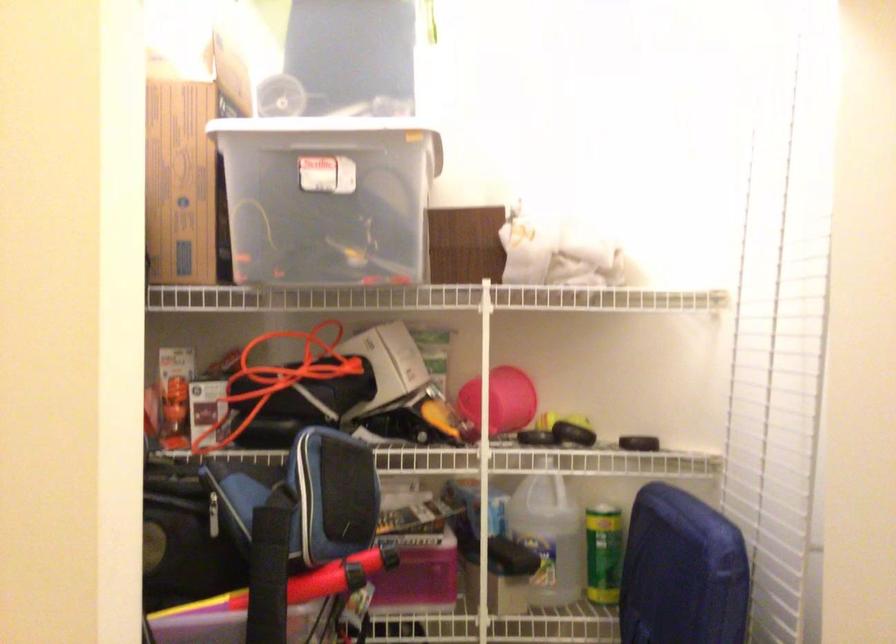
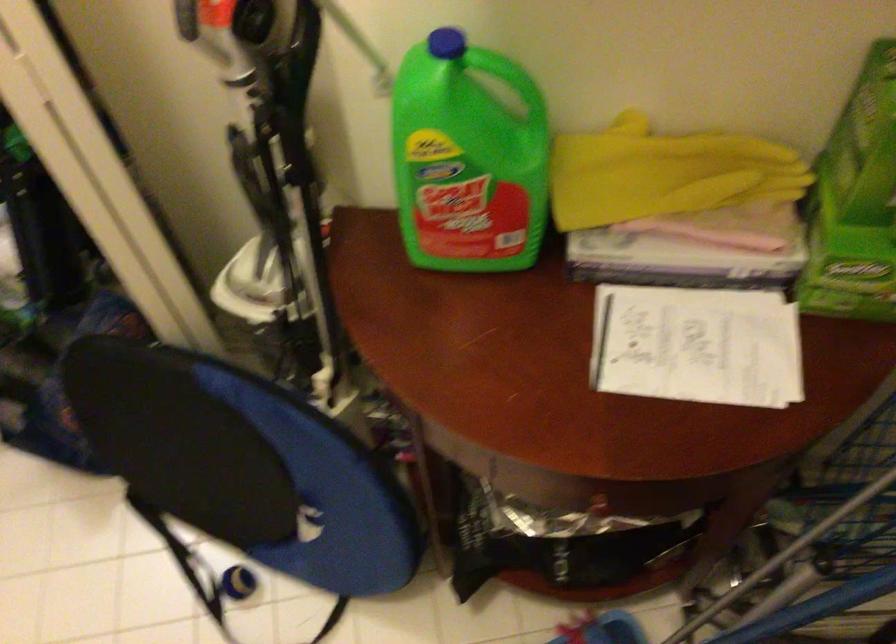
Question: How did the camera likely rotate?

Choices:
 (A) Left
 (B) Right
 (C) Up
 (D) Down

Answer: (D)